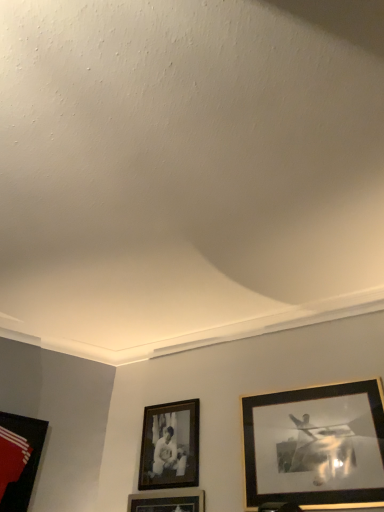
Question: Is gold-framed picture at right, the first picture frame when ordered from right to left, facing away from black matte picture frame at center, the second picture frame in the right-to-left sequence?

Choices:
 (A) no
 (B) yes

Answer: (A)

Question: Is gold-framed picture at right, the first picture frame when ordered from right to left, at the left side of black matte picture frame at center, the 2th picture frame when ordered from left to right?

Choices:
 (A) yes
 (B) no

Answer: (B)

Question: From a real-world perspective, is gold-framed picture at right, the first picture frame when ordered from right to left, over black matte picture frame at center, the 2th picture frame when ordered from left to right?

Choices:
 (A) no
 (B) yes

Answer: (A)

Question: Is gold-framed picture at right, the first picture frame when ordered from right to left, completely or partially outside of black matte picture frame at center, the second picture frame in the right-to-left sequence?

Choices:
 (A) no
 (B) yes

Answer: (B)

Question: From the image's perspective, is gold-framed picture at right, which is the 3th picture frame in left-to-right order, located above black matte picture frame at center, the second picture frame in the right-to-left sequence?

Choices:
 (A) yes
 (B) no

Answer: (A)

Question: Considering the relative sizes of gold-framed picture at right, which is the 3th picture frame in left-to-right order, and black matte picture frame at center, the 2th picture frame when ordered from left to right, in the image provided, is gold-framed picture at right, which is the 3th picture frame in left-to-right order, bigger than black matte picture frame at center, the 2th picture frame when ordered from left to right,?

Choices:
 (A) no
 (B) yes

Answer: (B)

Question: From a real-world perspective, does black matte picture frame at center, the second picture frame in the right-to-left sequence, stand above gold-framed picture at right, which is the 3th picture frame in left-to-right order?

Choices:
 (A) yes
 (B) no

Answer: (A)

Question: Is black matte picture frame at center, the 2th picture frame when ordered from left to right, beside gold-framed picture at right, which is the 3th picture frame in left-to-right order?

Choices:
 (A) yes
 (B) no

Answer: (B)

Question: Is black matte picture frame at center, the second picture frame in the right-to-left sequence, aimed at gold-framed picture at right, the first picture frame when ordered from right to left?

Choices:
 (A) yes
 (B) no

Answer: (B)

Question: Considering the relative sizes of black matte picture frame at center, the 2th picture frame when ordered from left to right, and gold-framed picture at right, the first picture frame when ordered from right to left, in the image provided, is black matte picture frame at center, the 2th picture frame when ordered from left to right, thinner than gold-framed picture at right, the first picture frame when ordered from right to left,?

Choices:
 (A) yes
 (B) no

Answer: (B)

Question: Does black matte picture frame at center, the 2th picture frame when ordered from left to right, have a greater width compared to gold-framed picture at right, which is the 3th picture frame in left-to-right order?

Choices:
 (A) no
 (B) yes

Answer: (B)

Question: From the image's perspective, is black matte picture frame at center, the second picture frame in the right-to-left sequence, over gold-framed picture at right, which is the 3th picture frame in left-to-right order?

Choices:
 (A) yes
 (B) no

Answer: (B)

Question: Can gold-framed picture at right, which is the 3th picture frame in left-to-right order, be found inside matte black picture frame at lower left, the 3th picture frame from the right?

Choices:
 (A) yes
 (B) no

Answer: (B)